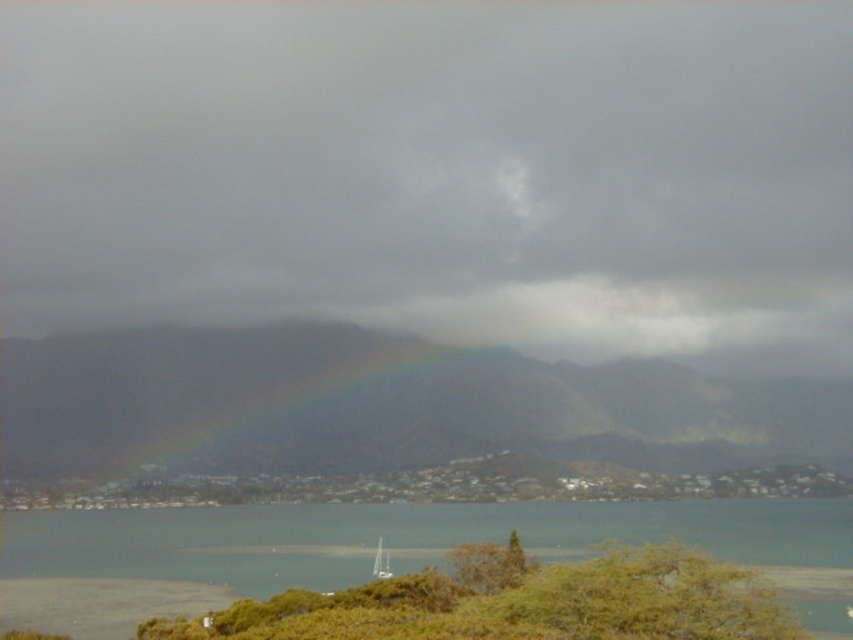
You are an artist planning to paint the scene. You want to ensure the clear water at lower center and the rainbow at center are proportionally accurate. Which object should you paint wider to maintain the correct proportions?

The clear water at lower center should be painted wider than the rainbow at center because its width surpasses the rainbow at center according to the description.

You are standing on the shore of the lake and see the rainbow at center and the white sailboat at center. From your perspective, which object is positioned to the right?

The rainbow at center is positioned to the right of the white sailboat at center.